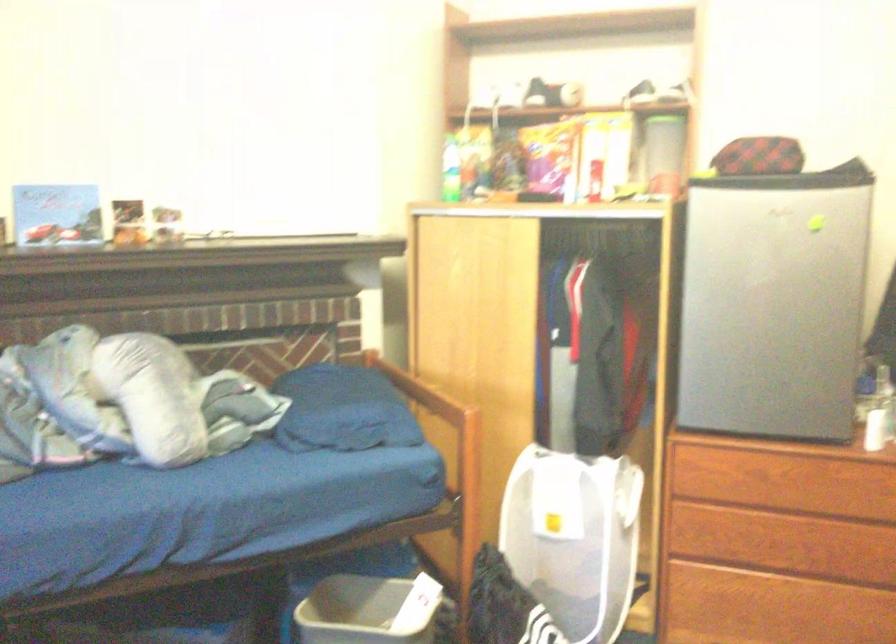
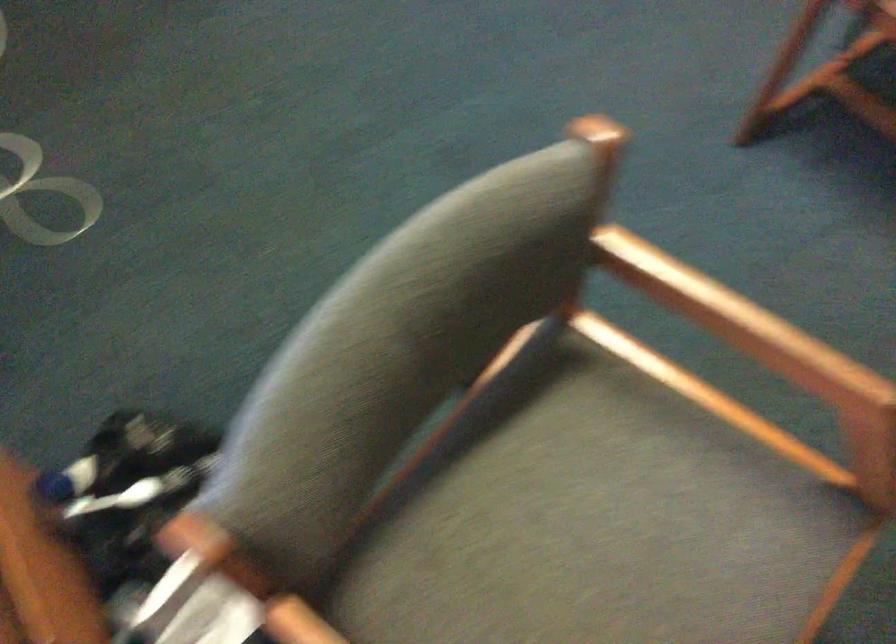
Question: The first image is from the beginning of the video and the second image is from the end. How did the camera likely rotate when shooting the video?

Choices:
 (A) Left
 (B) Right
 (C) Up
 (D) Down

Answer: (D)